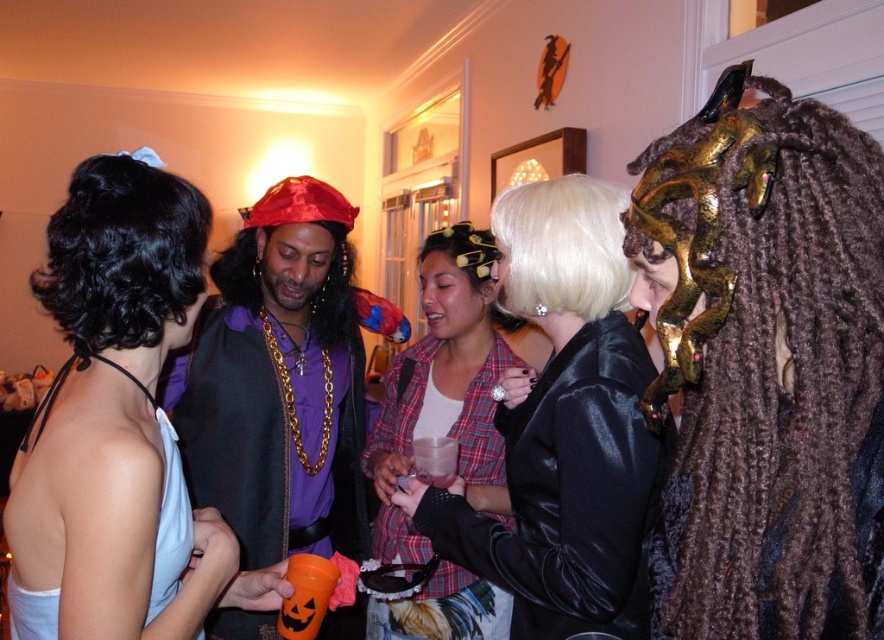
Can you confirm if black curly wig at upper left is positioned to the left of orange plastic cup at center?

Indeed, black curly wig at upper left is positioned on the left side of orange plastic cup at center.

Who is shorter, black curly wig at upper left or orange plastic cup at center?

Standing shorter between the two is orange plastic cup at center.

Who is more forward, (78, 275) or (309, 611)?

Positioned in front is point (78, 275).

Where is `black curly wig at upper left`? black curly wig at upper left is located at coordinates (122, 253).

Does shiny gold mask at center appear under shiny black leather jacket at center?

Incorrect, shiny gold mask at center is not positioned below shiny black leather jacket at center.

Which is in front, point (668, 168) or point (542, 216)?

Positioned in front is point (668, 168).

I want to click on shiny gold mask at center, so click(767, 368).

Who is shorter, plaid fabric shirt at center or orange plastic cup at center?

With less height is orange plastic cup at center.

Can you confirm if plaid fabric shirt at center is positioned to the left of orange plastic cup at center?

In fact, plaid fabric shirt at center is to the right of orange plastic cup at center.

The width and height of the screenshot is (884, 640). What do you see at coordinates (442, 381) in the screenshot?
I see `plaid fabric shirt at center` at bounding box center [442, 381].

This screenshot has height=640, width=884. I want to click on plaid fabric shirt at center, so click(x=442, y=381).